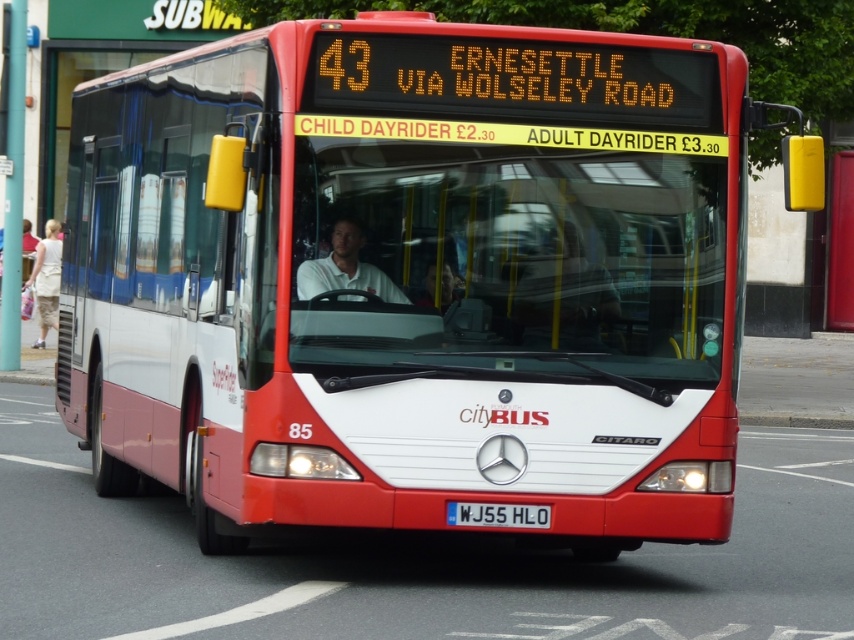
In the scene shown: You are a pedestrian standing in front of the bus. You notice two white items on the front of the bus. Which one is wider, the white textured dress at lower left or the white metallic license plate at center?

The white textured dress at lower left is wider than the white metallic license plate at center according to the description.

You are a photographer standing in front of the Citybus route 43. You notice two white items in your viewfinder, the white matte shirt at center and the white textured dress at lower left. Which of these two items appears smaller in your photo?

The white matte shirt at center appears smaller than the white textured dress at lower left in the photo.